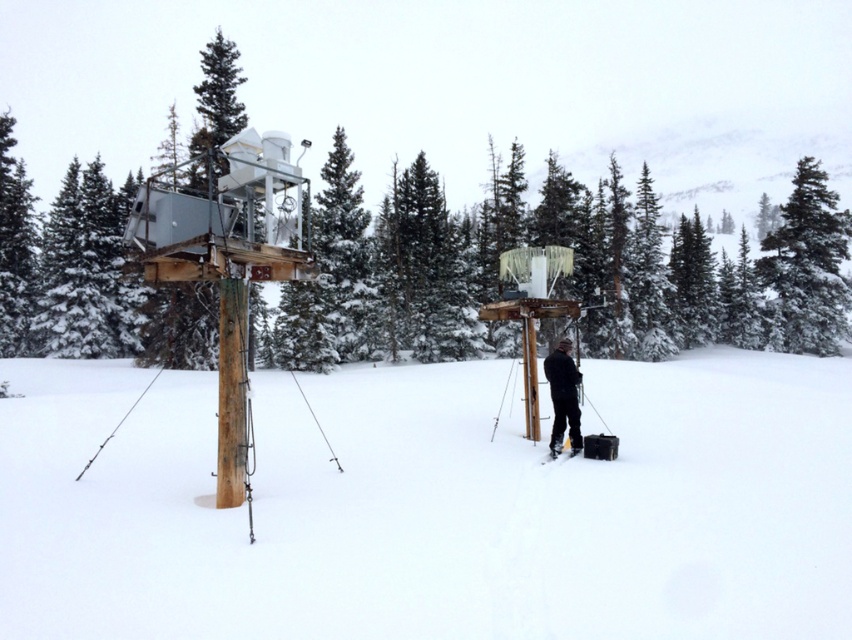
Does snow-covered evergreen at upper right appear under black matte jacket at center?

No.

Can you confirm if snow-covered evergreen at upper right is smaller than black matte jacket at center?

Actually, snow-covered evergreen at upper right might be larger than black matte jacket at center.

Is point (787, 200) positioned behind point (560, 412)?

That is True.

Identify the location of snow-covered evergreen at upper right. (807, 266).

Can you confirm if white snow at center is positioned to the left of green snow-covered tree at upper left?

Incorrect, white snow at center is not on the left side of green snow-covered tree at upper left.

Is white snow at center smaller than green snow-covered tree at upper left?

Yes, white snow at center is smaller than green snow-covered tree at upper left.

Is point (361, 544) positioned behind point (85, 349)?

No, (361, 544) is closer to viewer.

Locate an element on the screen. The height and width of the screenshot is (640, 852). white snow at center is located at coordinates (430, 504).

Locate an element on the screen. The height and width of the screenshot is (640, 852). green snow-covered tree at upper left is located at coordinates (85, 272).

Who is taller, green snow-covered tree at upper left or snow-covered evergreen at upper right?

With more height is snow-covered evergreen at upper right.

At what (x,y) coordinates should I click in order to perform the action: click on green snow-covered tree at upper left. Please return your answer as a coordinate pair (x, y). This screenshot has width=852, height=640. Looking at the image, I should click on (85, 272).